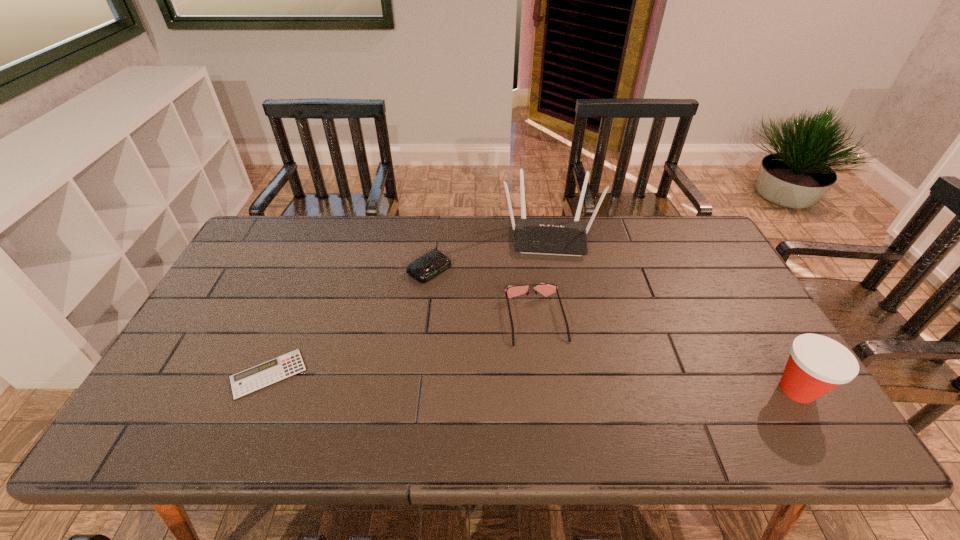
The width and height of the screenshot is (960, 540). Identify the location of alarm clock positioned at the far edge. (433, 263).

The width and height of the screenshot is (960, 540). In order to click on router located in the far edge section of the desktop in this screenshot , I will do `click(533, 236)`.

Identify the location of calculator located at the near edge. The height and width of the screenshot is (540, 960). (252, 379).

Where is `Dixie cup present at the near edge`? The image size is (960, 540). Dixie cup present at the near edge is located at coordinates (817, 364).

Locate an element on the screen. Image resolution: width=960 pixels, height=540 pixels. object that is at the left edge is located at coordinates (252, 379).

The image size is (960, 540). What are the coordinates of `object located at the right edge` in the screenshot? It's located at (817, 364).

Locate an element on the screen. Image resolution: width=960 pixels, height=540 pixels. object that is positioned at the near left corner is located at coordinates (252, 379).

This screenshot has width=960, height=540. Find the location of `object located at the near right corner`. object located at the near right corner is located at coordinates (817, 364).

Locate an element on the screen. This screenshot has height=540, width=960. vacant space at the far edge of the desktop is located at coordinates (367, 228).

I want to click on blank space at the near edge of the desktop, so click(702, 392).